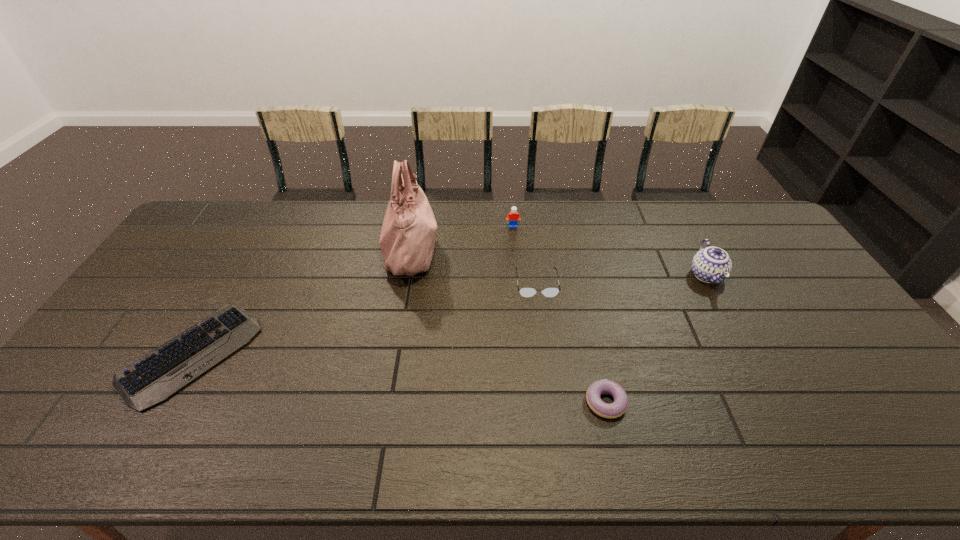
At what (x,y) coordinates should I click in order to perform the action: click on vacant region between the second shortest object and the chinaware. Please return your answer as a coordinate pair (x, y). This screenshot has width=960, height=540. Looking at the image, I should click on (656, 339).

Where is `free space between the fifth shortest object and the Lego`? free space between the fifth shortest object and the Lego is located at coordinates (610, 251).

Locate an element on the screen. free spot between the spectacles and the fourth shortest object is located at coordinates (525, 255).

Locate an element on the screen. Image resolution: width=960 pixels, height=540 pixels. object that is the fifth closest to the doughnut is located at coordinates (156, 376).

Locate an element on the screen. object that stands as the fourth closest to the fourth tallest object is located at coordinates (712, 265).

This screenshot has height=540, width=960. In order to click on vacant space that satisfies the following two spatial constraints: 1. at the front of the fifth tallest object with handles; 2. on the right side of the handbag in this screenshot , I will do click(384, 402).

Identify the location of free space that satisfies the following two spatial constraints: 1. at the front of the tallest object with handles; 2. on the front side of the leftmost object. The width and height of the screenshot is (960, 540). (392, 355).